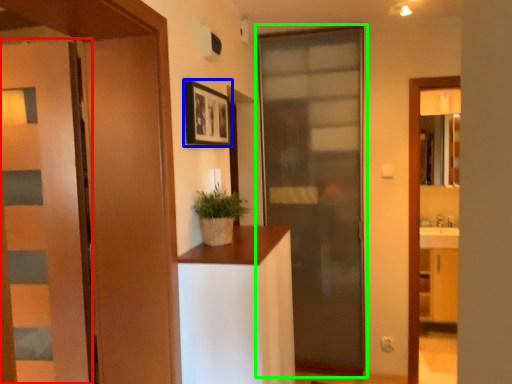
Question: Estimate the real-world distances between objects in this image. Which object is farther from door (highlighted by a red box), picture frame (highlighted by a blue box) or door (highlighted by a green box)?

Choices:
 (A) picture frame
 (B) door

Answer: (B)